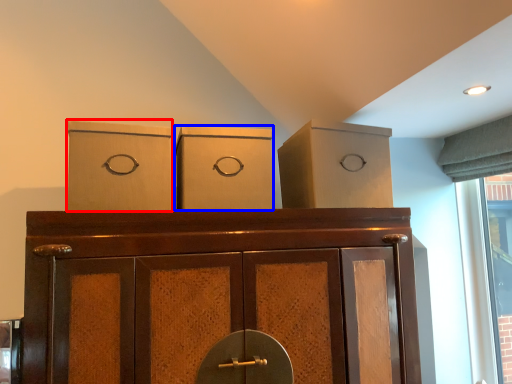
Question: Which point is closer to the camera, cardboard box (highlighted by a red box) or cardboard box (highlighted by a blue box)?

Choices:
 (A) cardboard box
 (B) cardboard box

Answer: (A)